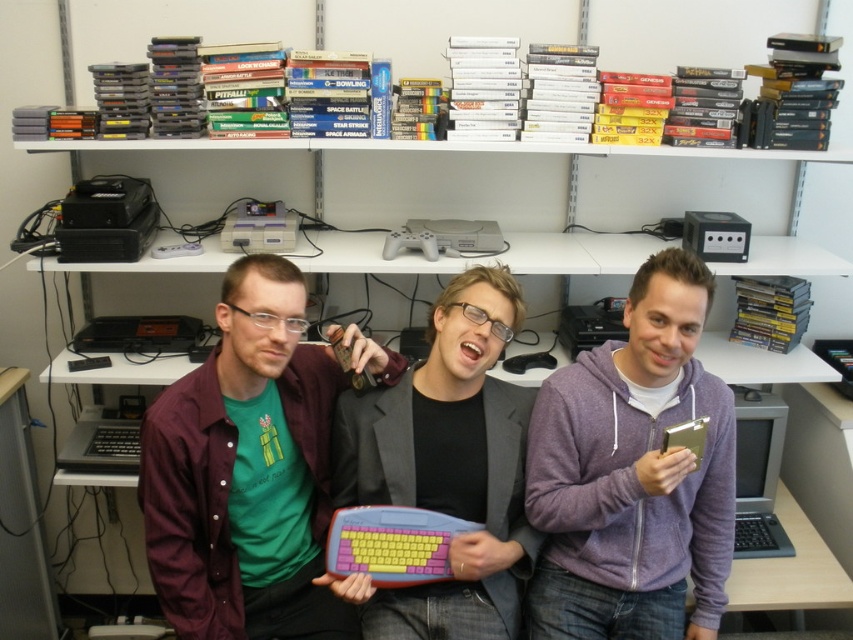
Is point (315, 445) farther from viewer compared to point (746, 509)?

No, it is not.

Who is lower down, green matte shirt at center or silver metallic monitor at lower right?

silver metallic monitor at lower right

Which is in front, point (239, 280) or point (740, 492)?

Positioned in front is point (239, 280).

Find the location of a particular element. green matte shirt at center is located at coordinates (250, 468).

Can you confirm if purple fleece hoodie at center is bigger than rubberized plastic keyboard at center?

Yes, purple fleece hoodie at center is bigger than rubberized plastic keyboard at center.

Who is more distant from viewer, (680, 400) or (346, 445)?

The point (346, 445) is more distant.

Who is more forward, [608,428] or [502,625]?

Positioned in front is point [502,625].

Locate an element on the screen. purple fleece hoodie at center is located at coordinates click(x=633, y=474).

Does green matte shirt at center appear under purple fleece hoodie at center?

No.

Is point (354, 339) closer to viewer compared to point (692, 364)?

No, (354, 339) is behind (692, 364).

Where is `green matte shirt at center`? This screenshot has height=640, width=853. green matte shirt at center is located at coordinates (250, 468).